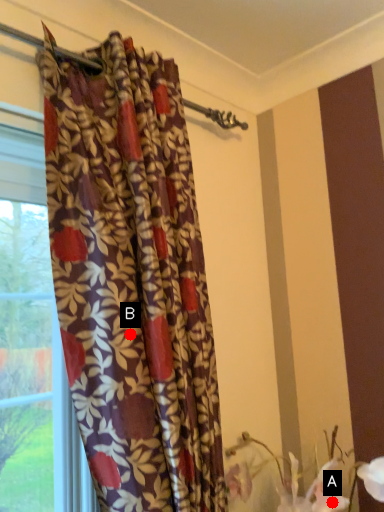
Question: Two points are circled on the image, labeled by A and B beside each circle. Which point is farther to the camera?

Choices:
 (A) A is further
 (B) B is further

Answer: (A)